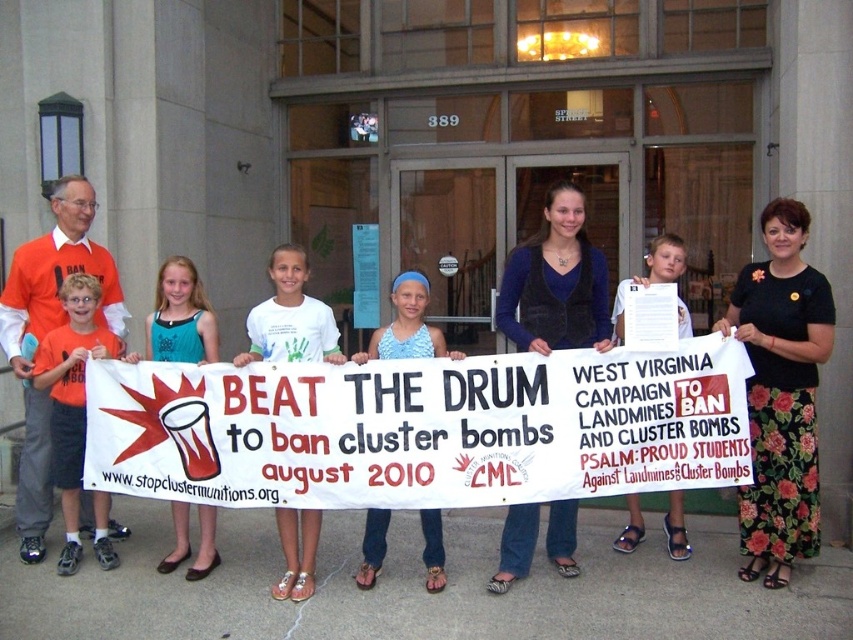
Is orange t-shirt at left smaller than blue printed tank top at center?

No, orange t-shirt at left is not smaller than blue printed tank top at center.

Who is more distant from viewer, (45, 372) or (374, 563)?

Point (374, 563)

Which is in front, point (74, 387) or point (370, 540)?

Point (370, 540) is more forward.

Where is `orange t-shirt at left`? orange t-shirt at left is located at coordinates (71, 396).

Does white cotton shirt at center have a larger size compared to white paper at center?

Incorrect, white cotton shirt at center is not larger than white paper at center.

Can you confirm if white cotton shirt at center is taller than white paper at center?

In fact, white cotton shirt at center may be shorter than white paper at center.

Where is `white cotton shirt at center`? white cotton shirt at center is located at coordinates (289, 317).

Does white cotton shirt at center appear over blue printed tank top at center?

Yes, white cotton shirt at center is above blue printed tank top at center.

Is white cotton shirt at center to the right of blue printed tank top at center from the viewer's perspective?

Incorrect, white cotton shirt at center is not on the right side of blue printed tank top at center.

Does point (287, 528) lie in front of point (404, 284)?

No.

Find the location of `white cotton shirt at center`. white cotton shirt at center is located at coordinates (289, 317).